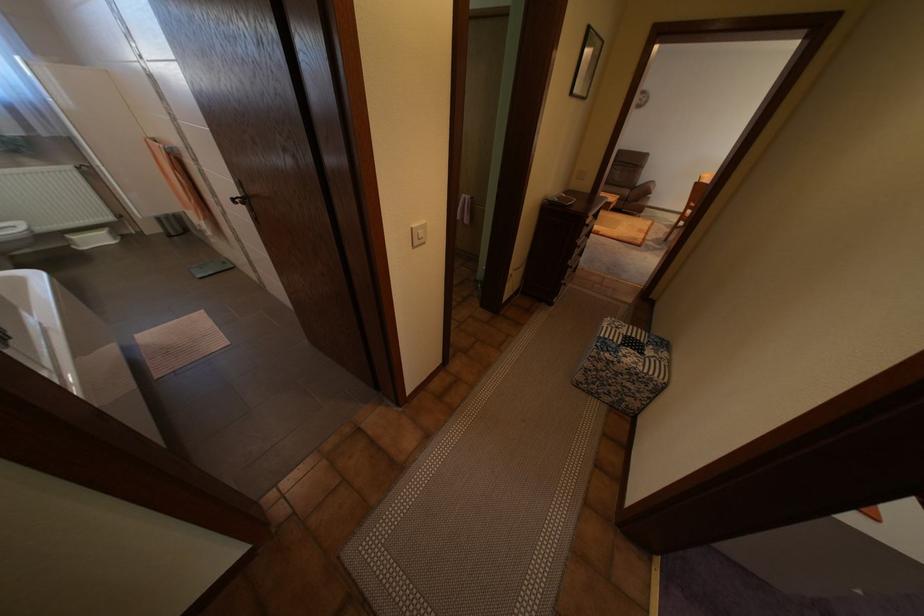
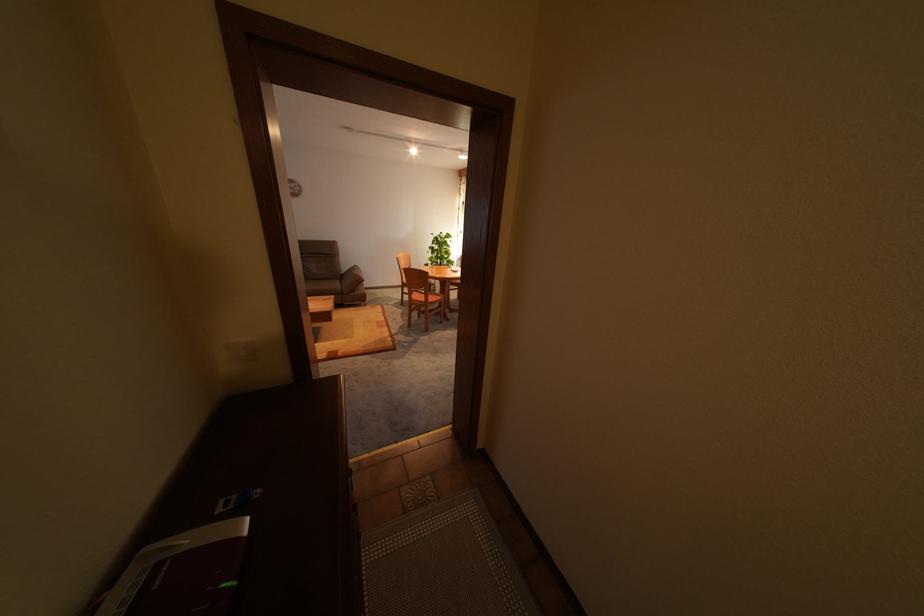
Where in the second image is the point corresponding to point 637,191 from the first image?

(347, 284)